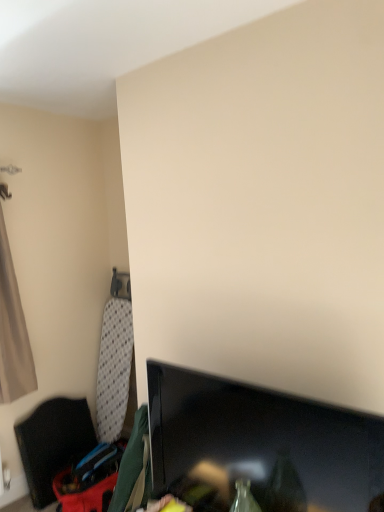
Identify the location of beige fabric curtain at left. (13, 331).

The image size is (384, 512). What are the coordinates of `black fabric chair at left` in the screenshot? It's located at (53, 443).

Locate an element on the screen. The width and height of the screenshot is (384, 512). black glossy tv at lower right is located at coordinates (262, 442).

Where is `beige fabric curtain at left`? Image resolution: width=384 pixels, height=512 pixels. beige fabric curtain at left is located at coordinates (13, 331).

Is black fabric chair at left turned away from beige fabric curtain at left?

That's not correct — black fabric chair at left is not looking away from beige fabric curtain at left.

In the image, is black fabric chair at left on the left side or the right side of beige fabric curtain at left?

Clearly, black fabric chair at left is on the right of beige fabric curtain at left in the image.

In the image, is black fabric chair at left positioned in front of or behind beige fabric curtain at left?

In the image, black fabric chair at left appears behind beige fabric curtain at left.

From a real-world perspective, who is located lower, black fabric chair at left or beige fabric curtain at left?

black fabric chair at left, from a real-world perspective.

Choose the correct answer: Is black glossy tv at lower right inside beige fabric curtain at left or outside it?

black glossy tv at lower right is outside beige fabric curtain at left.

Is there a large distance between black glossy tv at lower right and beige fabric curtain at left?

black glossy tv at lower right is positioned a significant distance from beige fabric curtain at left.

From the image's perspective, which object appears higher, black glossy tv at lower right or beige fabric curtain at left?

beige fabric curtain at left appears higher in the image.

From a real-world perspective, is black glossy tv at lower right on beige fabric curtain at left?

No, from a real-world perspective, black glossy tv at lower right is not on top of beige fabric curtain at left.

Looking at the image, does beige fabric curtain at left seem bigger or smaller compared to black fabric chair at left?

In the image, beige fabric curtain at left appears to be smaller than black fabric chair at left.

Between point (5, 240) and point (50, 493), which one is positioned in front?

The point (5, 240) is in front.

How far apart are beige fabric curtain at left and black fabric chair at left?

beige fabric curtain at left and black fabric chair at left are 17.89 inches apart.

Is beige fabric curtain at left far away from black fabric chair at left?

beige fabric curtain at left is near black fabric chair at left, not far away.

Between beige fabric curtain at left and black glossy tv at lower right, which one appears on the left side from the viewer's perspective?

beige fabric curtain at left.

Who is taller, beige fabric curtain at left or black glossy tv at lower right?

beige fabric curtain at left is taller.

Between beige fabric curtain at left and black glossy tv at lower right, which one has smaller size?

black glossy tv at lower right.

Is beige fabric curtain at left turned away from black glossy tv at lower right?

No, black glossy tv at lower right is not at the back of beige fabric curtain at left.

I want to click on television in front of the black fabric chair at left, so click(x=262, y=442).

Could you tell me if black glossy tv at lower right is facing black fabric chair at left?

No, black glossy tv at lower right is not facing towards black fabric chair at left.

From a real-world perspective, between black glossy tv at lower right and black fabric chair at left, who is vertically higher?

black glossy tv at lower right, from a real-world perspective.

Is there a large distance between black glossy tv at lower right and black fabric chair at left?

black glossy tv at lower right is positioned a significant distance from black fabric chair at left.

Is black fabric chair at left completely or partially outside of black glossy tv at lower right?

Yes.

Could you tell me if black fabric chair at left is facing black glossy tv at lower right?

Yes, black fabric chair at left is turned towards black glossy tv at lower right.

From a real-world perspective, is black fabric chair at left on black glossy tv at lower right?

Actually, black fabric chair at left is physically below black glossy tv at lower right in the real world.

The image size is (384, 512). Identify the location of curtain on the left of black fabric chair at left. [13, 331].

In order to click on curtain above the black glossy tv at lower right (from a real-world perspective) in this screenshot , I will do `click(13, 331)`.

Considering their positions, is black glossy tv at lower right positioned closer to black fabric chair at left than beige fabric curtain at left?

beige fabric curtain at left is positioned closer to the anchor black fabric chair at left.

Considering their positions, is black fabric chair at left positioned closer to black glossy tv at lower right than beige fabric curtain at left?

black fabric chair at left.

When comparing their distances from black glossy tv at lower right, does beige fabric curtain at left or black fabric chair at left seem closer?

black fabric chair at left lies closer to black glossy tv at lower right than the other object.

Estimate the real-world distances between objects in this image. Which object is further from black fabric chair at left, beige fabric curtain at left or black glossy tv at lower right?

black glossy tv at lower right is positioned further to the anchor black fabric chair at left.

Looking at the image, which one is located further to beige fabric curtain at left, black glossy tv at lower right or black fabric chair at left?

Among the two, black glossy tv at lower right is located further to beige fabric curtain at left.

Considering their positions, is black fabric chair at left positioned closer to beige fabric curtain at left than black glossy tv at lower right?

Among the two, black fabric chair at left is located nearer to beige fabric curtain at left.

At what (x,y) coordinates should I click in order to perform the action: click on furniture between beige fabric curtain at left and black glossy tv at lower right. Please return your answer as a coordinate pair (x, y). The image size is (384, 512). Looking at the image, I should click on (53, 443).